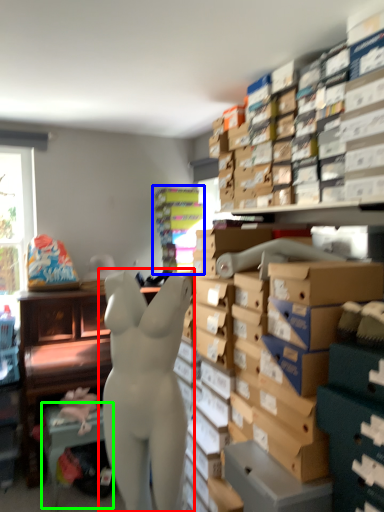
Question: Which is farther away from person (highlighted by a red box)? shelf (highlighted by a blue box) or table (highlighted by a green box)?

Choices:
 (A) shelf
 (B) table

Answer: (A)